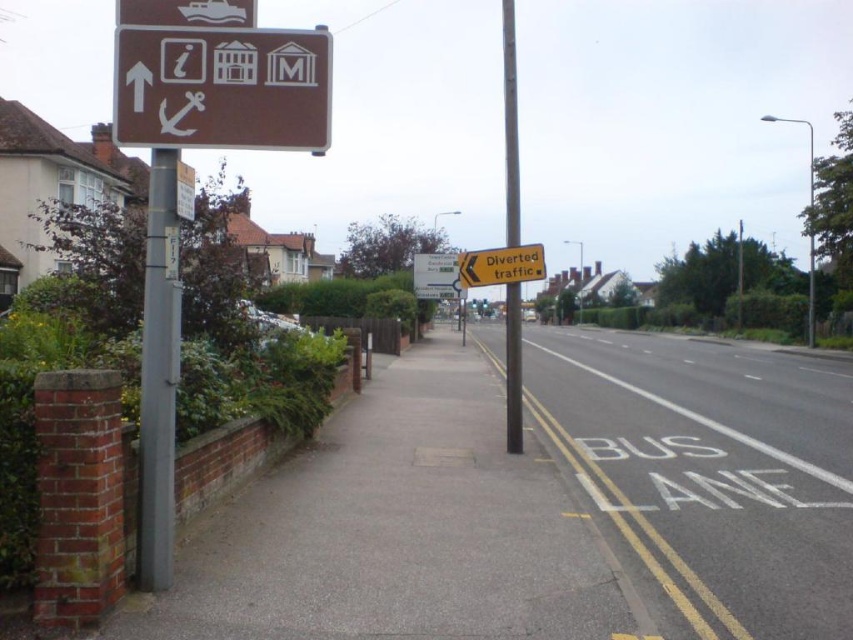
You are a delivery person needing to secure a package to a pole. The package requires a pole at least 2 meters tall. You see the metallic pole at left and the metallic gray pole at center. Which pole should you choose?

The metallic gray pole at center is taller than the metallic pole at left. Since the package requires a pole at least 2 meters tall, you should choose the metallic gray pole at center.

You are a pedestrian standing on the gray concrete sidewalk at left and want to read the yellow paper sign at upper center. Which direction should you move to reach it?

The gray concrete sidewalk at left is to the left of yellow paper sign at upper center, so you should move to the right to reach the sign.